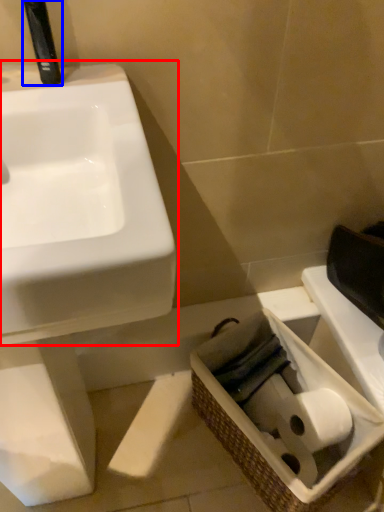
Question: Among these objects, which one is farthest to the camera, sink (highlighted by a red box) or plumbing fixture (highlighted by a blue box)?

Choices:
 (A) sink
 (B) plumbing fixture

Answer: (B)